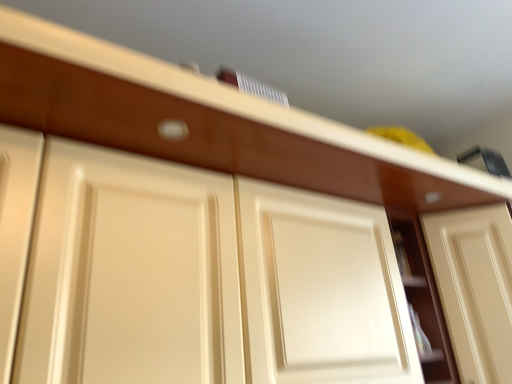
What is the approximate height of matte cream cabinet door at center, which ranks as the second door in right-to-left order?

matte cream cabinet door at center, which ranks as the second door in right-to-left order, is 21.23 inches tall.

This screenshot has width=512, height=384. Find the location of `matte cream cabinet at center`. matte cream cabinet at center is located at coordinates (423, 298).

Is matte cream door at center, acting as the 1th door starting from the right, taller than matte cream drawer at center?

Yes, matte cream door at center, acting as the 1th door starting from the right, is taller than matte cream drawer at center.

Is matte cream door at center, which is the second door from left to right, turned away from matte cream drawer at center?

No.

Does matte cream door at center, acting as the 1th door starting from the right, appear on the right side of matte cream drawer at center?

Yes.

Looking at this image, between matte cream door at center, which is the second door from left to right, and matte cream drawer at center, which one has larger size?

Bigger between the two is matte cream door at center, which is the second door from left to right.

Considering the points (163, 103) and (408, 243), which point is in front, point (163, 103) or point (408, 243)?

Positioned in front is point (163, 103).

Can you confirm if matte cream drawer at center is positioned to the right of matte cream cabinet at center?

No, matte cream drawer at center is not to the right of matte cream cabinet at center.

Is matte cream drawer at center looking in the opposite direction of matte cream cabinet at center?

No, matte cream drawer at center is not facing away from matte cream cabinet at center.

Is matte cream drawer at center not near matte cream cabinet at center?

No, there isn't a large distance between matte cream drawer at center and matte cream cabinet at center.

Is matte cream cabinet at center turned away from matte cream drawer at center?

matte cream cabinet at center does not have its back to matte cream drawer at center.

From the picture: Is matte cream cabinet at center not close to matte cream drawer at center?

Actually, matte cream cabinet at center and matte cream drawer at center are a little close together.

Considering their positions, is matte cream cabinet at center located in front of or behind matte cream drawer at center?

matte cream cabinet at center is positioned farther from the viewer than matte cream drawer at center.

Which object is thinner, matte cream cabinet at center or matte cream drawer at center?

matte cream cabinet at center.

Is matte cream cabinet at center touching matte white door handle at upper center?

There is a gap between matte cream cabinet at center and matte white door handle at upper center.

From the picture: Considering the sizes of objects matte cream cabinet at center and matte white door handle at upper center in the image provided, who is smaller, matte cream cabinet at center or matte white door handle at upper center?

matte white door handle at upper center.

Which of these two, matte cream cabinet at center or matte white door handle at upper center, is thinner?

matte white door handle at upper center is thinner.

How different are the orientations of matte cream cabinet at center and matte white door handle at upper center in degrees?

matte cream cabinet at center and matte white door handle at upper center are facing 0.181 degrees away from each other.

From the image's perspective, does matte white door handle at upper center appear higher than matte cream door at center, acting as the 1th door starting from the right?

Yes, from the image's perspective, matte white door handle at upper center is on top of matte cream door at center, acting as the 1th door starting from the right.

Is matte white door handle at upper center touching matte cream door at center, acting as the 1th door starting from the right?

No, matte white door handle at upper center is not beside matte cream door at center, acting as the 1th door starting from the right.

Considering the positions of objects matte white door handle at upper center and matte cream door at center, which is the second door from left to right, in the image provided, who is in front, matte white door handle at upper center or matte cream door at center, which is the second door from left to right,?

matte white door handle at upper center is in front.

Is point (172, 134) closer to camera compared to point (454, 319)?

Yes, point (172, 134) is closer to viewer.

Would you say matte cream drawer at center is inside or outside matte cream cabinet door at center, which ranks as the second door in right-to-left order?

matte cream drawer at center lies outside matte cream cabinet door at center, which ranks as the second door in right-to-left order.

The height and width of the screenshot is (384, 512). Identify the location of drawer that is behind the matte cream cabinet door at center, marked as the first door in a left-to-right arrangement. (208, 136).

In the scene shown: From the image's perspective, which is above, matte cream drawer at center or matte cream cabinet door at center, which ranks as the second door in right-to-left order?

matte cream drawer at center, from the image's perspective.

Based on the photo, which object is more forward, matte cream drawer at center or matte cream cabinet door at center, which ranks as the second door in right-to-left order?

matte cream cabinet door at center, which ranks as the second door in right-to-left order.

Is matte cream cabinet at center turned away from matte cream door at center, which is the second door from left to right?

No.

Where is `cabinet above the matte cream door at center, which is the second door from left to right (from the image's perspective)`? The image size is (512, 384). cabinet above the matte cream door at center, which is the second door from left to right (from the image's perspective) is located at coordinates (423, 298).

Is matte cream cabinet at center outside of matte cream door at center, acting as the 1th door starting from the right?

Absolutely, matte cream cabinet at center is external to matte cream door at center, acting as the 1th door starting from the right.

Consider the image. Considering the sizes of objects matte cream cabinet at center and matte cream door at center, which is the second door from left to right, in the image provided, who is thinner, matte cream cabinet at center or matte cream door at center, which is the second door from left to right,?

With smaller width is matte cream cabinet at center.

Where is `the 2nd door below when counting from the matte cream drawer at center (from the image's perspective)`? The height and width of the screenshot is (384, 512). the 2nd door below when counting from the matte cream drawer at center (from the image's perspective) is located at coordinates (475, 287).

This screenshot has width=512, height=384. Find the location of `cabinet below the matte cream drawer at center (from a real-world perspective)`. cabinet below the matte cream drawer at center (from a real-world perspective) is located at coordinates (423, 298).

Estimate the real-world distances between objects in this image. Which object is closer to matte cream cabinet at center, matte cream door at center, acting as the 1th door starting from the right, or matte white door handle at upper center?

Based on the image, matte cream door at center, acting as the 1th door starting from the right, appears to be nearer to matte cream cabinet at center.

Looking at this image, from the image, which object appears to be farther from matte cream drawer at center, matte cream cabinet at center or matte cream door at center, acting as the 1th door starting from the right?

matte cream cabinet at center is positioned further to the anchor matte cream drawer at center.

From the picture: Considering their positions, is matte white door handle at upper center positioned further to matte cream drawer at center than matte cream cabinet at center?

The object further to matte cream drawer at center is matte cream cabinet at center.

From the image, which object appears to be farther from matte cream drawer at center, matte cream door at center, which is the second door from left to right, or matte white door handle at upper center?

matte cream door at center, which is the second door from left to right, is positioned further to the anchor matte cream drawer at center.

Looking at the image, which one is located closer to matte cream door at center, acting as the 1th door starting from the right, matte cream drawer at center or matte white door handle at upper center?

matte cream drawer at center is positioned closer to the anchor matte cream door at center, acting as the 1th door starting from the right.

Based on the photo, estimate the real-world distances between objects in this image. Which object is closer to matte cream drawer at center, matte white door handle at upper center or matte cream door at center, which is the second door from left to right?

matte white door handle at upper center is positioned closer to the anchor matte cream drawer at center.

Considering their positions, is matte cream cabinet at center positioned closer to matte white door handle at upper center than matte cream door at center, acting as the 1th door starting from the right?

Based on the image, matte cream cabinet at center appears to be nearer to matte white door handle at upper center.

Looking at the image, which one is located closer to matte cream cabinet door at center, which ranks as the second door in right-to-left order, matte white door handle at upper center or matte cream cabinet at center?

Among the two, matte white door handle at upper center is located nearer to matte cream cabinet door at center, which ranks as the second door in right-to-left order.

Find the location of a particular element. door between matte cream drawer at center and matte cream cabinet at center in the front-back direction is located at coordinates (475, 287).

Locate an element on the screen. Image resolution: width=512 pixels, height=384 pixels. drawer between matte cream cabinet door at center, which ranks as the second door in right-to-left order, and matte cream door at center, acting as the 1th door starting from the right, in the horizontal direction is located at coordinates (208, 136).

At what (x,y) coordinates should I click in order to perform the action: click on cabinet located between matte cream cabinet door at center, marked as the first door in a left-to-right arrangement, and matte cream door at center, which is the second door from left to right, in the left-right direction. Please return your answer as a coordinate pair (x, y). Looking at the image, I should click on (423, 298).

This screenshot has height=384, width=512. In order to click on cabinet between matte white door handle at upper center and matte cream door at center, which is the second door from left to right, in the horizontal direction in this screenshot , I will do `click(423, 298)`.